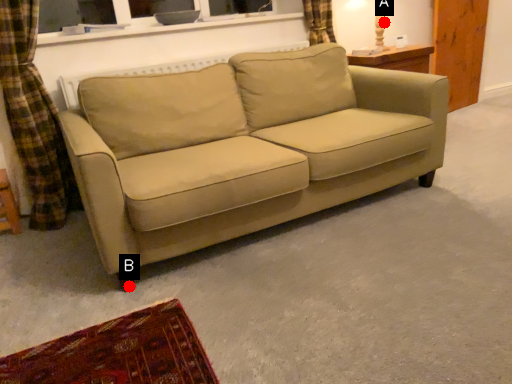
Question: Two points are circled on the image, labeled by A and B beside each circle. Which point is closer to the camera?

Choices:
 (A) A is closer
 (B) B is closer

Answer: (B)